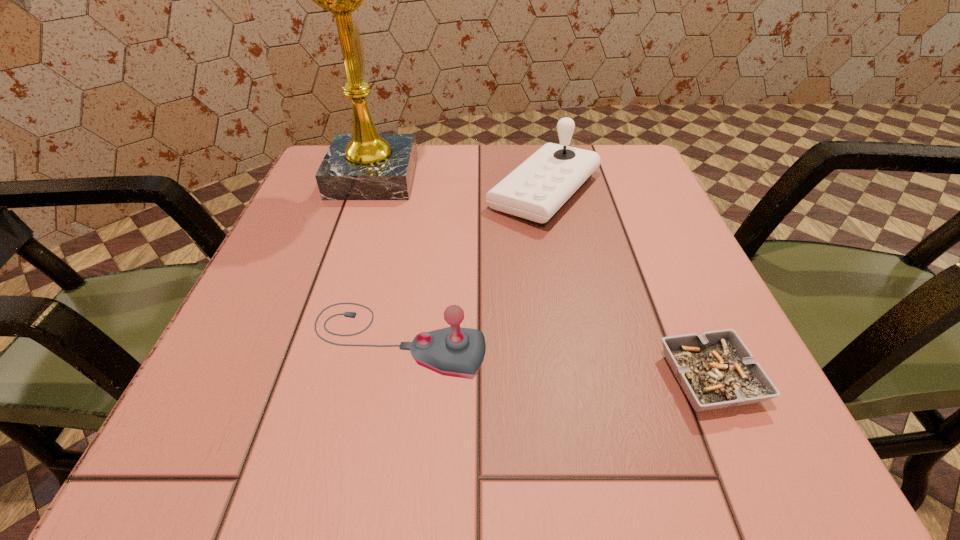
You are a GUI agent. You are given a task and a screenshot of the screen. Output one action in this format:
    pyautogui.click(x=<x>, y=<y>)
    Task: Click on the free location that satisfies the following two spatial constraints: 1. on the front-facing side of the tallest object; 2. on the right side of the ashtray
    The width and height of the screenshot is (960, 540).
    Given the screenshot: What is the action you would take?
    pyautogui.click(x=307, y=379)

Find the location of a particular element. vacant area in the image that satisfies the following two spatial constraints: 1. on the front-facing side of the award; 2. on the right side of the farther joystick is located at coordinates [369, 192].

What are the coordinates of `vacant position in the image that satisfies the following two spatial constraints: 1. on the front side of the second shortest object; 2. on the left side of the shortest object` in the screenshot? It's located at (391, 379).